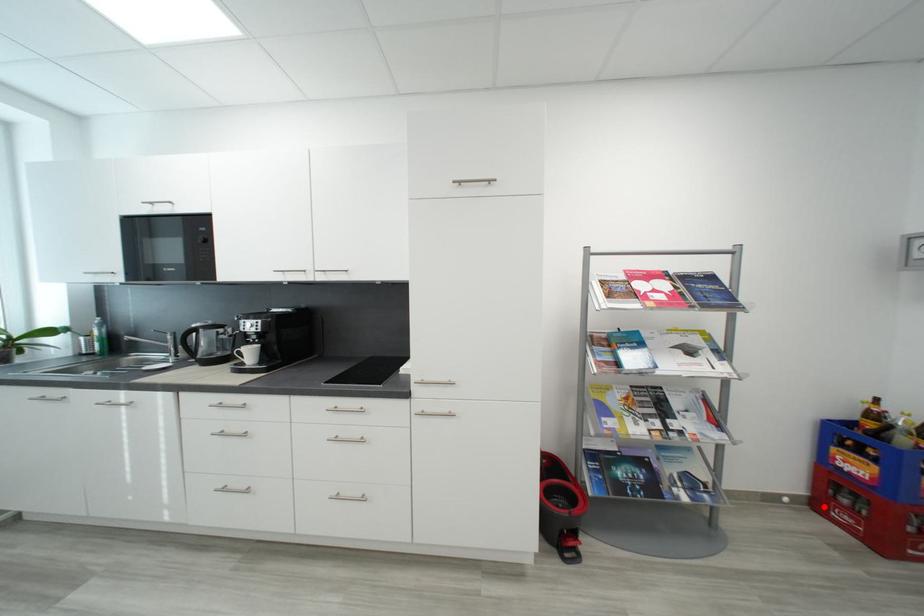
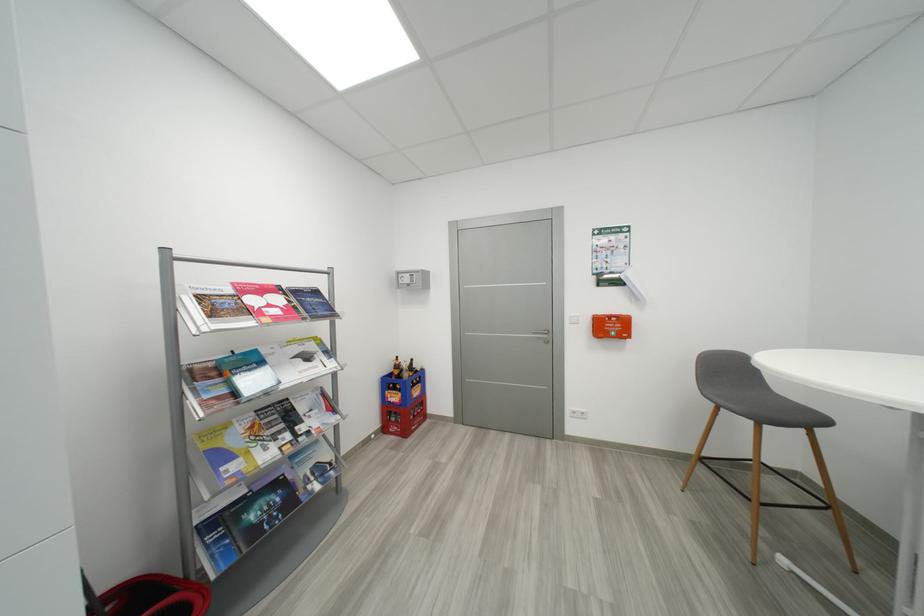
Question: I am providing you with two images of the same scene from different viewpoints. In image1, a red point is highlighted. Considering the same 3D point in image2, which of the following is correct?

Choices:
 (A) It is closer
 (B) It is farther

Answer: (B)